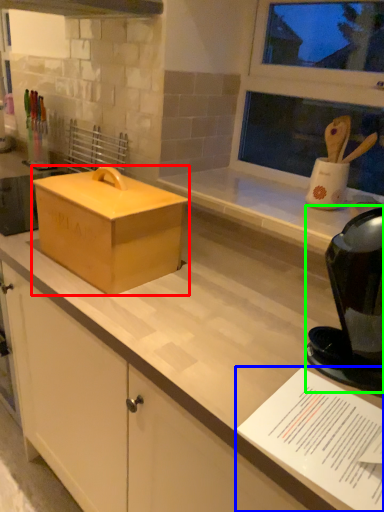
Question: Based on their relative distances, which object is nearer to box (highlighted by a red box)? Choose from paper (highlighted by a blue box) and appliance (highlighted by a green box).

Choices:
 (A) paper
 (B) appliance

Answer: (B)